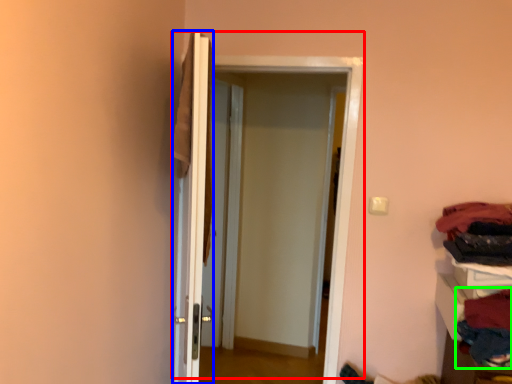
Question: Estimate the real-world distances between objects in this image. Which object is closer to door (highlighted by a red box), door (highlighted by a blue box) or clothing (highlighted by a green box)?

Choices:
 (A) door
 (B) clothing

Answer: (A)